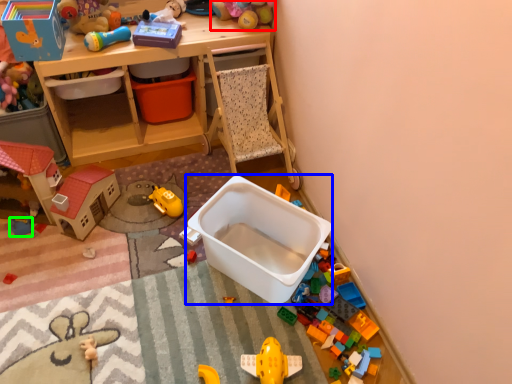
Question: Which object is the farthest from toy (highlighted by a red box)? Choose among these: storage box (highlighted by a blue box) or toy (highlighted by a green box).

Choices:
 (A) storage box
 (B) toy

Answer: (B)